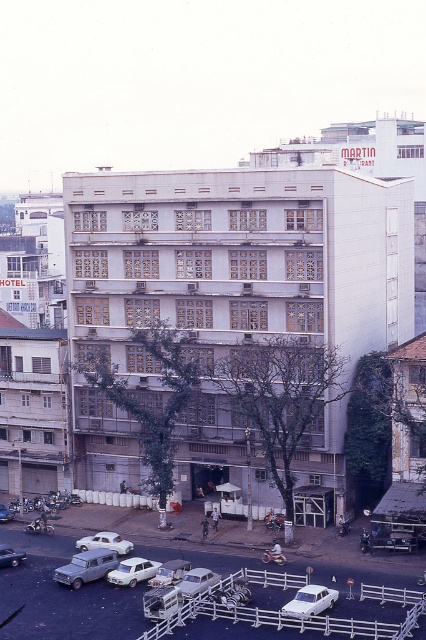
You are standing on the white matte parking lot at lower center and want to enter the white concrete building at center. Which direction should you walk to reach the entrance?

Since the white concrete building at center is located above the white matte parking lot at lower center, you should walk upwards towards the building to reach the entrance.

You are a delivery driver who needs to park your vehicle between the silver metallic sedan at lower left and the white matte car at center. Your vehicle is 1.8 meters wide. Can you fit your car in the available space between them?

The silver metallic sedan at lower left is wider than the white matte car at center. However, the exact width of the space between them isn not provided in the scene description. Therefore, it is uncertain whether your 1.8 meter wide vehicle can fit.

You are a customer arriving at the MARTIN RESTAURANT and need to park your car. You see a silver metallic sedan at center and a white matte sedan at lower left. Which car is parked closer to the entrance of the building?

The silver metallic sedan at center is located below the white matte sedan at lower left, meaning it is closer to the entrance since it is positioned lower in the image.